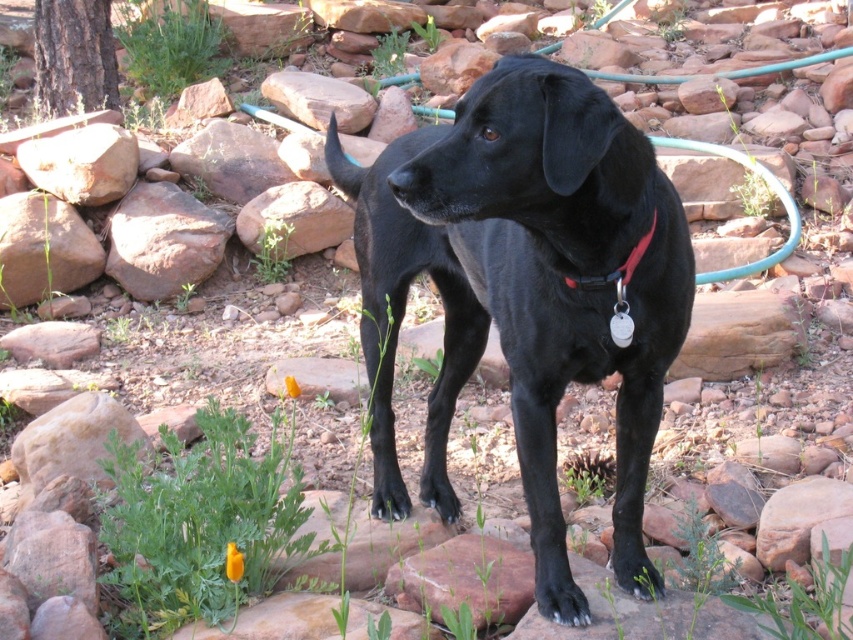
Question: Which point appears closest to the camera in this image?

Choices:
 (A) (651, 237)
 (B) (138, 227)

Answer: (A)

Question: Does green rubber hose at upper center have a larger size compared to red nylon collar at center?

Choices:
 (A) no
 (B) yes

Answer: (B)

Question: Among these objects, which one is nearest to the camera?

Choices:
 (A) smooth brown rock at upper left
 (B) black matte dog at center
 (C) green rubber hose at upper center
 (D) red nylon collar at center

Answer: (B)

Question: Considering the relative positions of black matte dog at center and green rubber hose at upper center in the image provided, where is black matte dog at center located with respect to green rubber hose at upper center?

Choices:
 (A) above
 (B) below

Answer: (B)

Question: In this image, where is reddish-brown rock at lower left located relative to green rubber hose at upper center?

Choices:
 (A) left
 (B) right

Answer: (A)

Question: Which point appears closest to the camera in this image?

Choices:
 (A) (485, 278)
 (B) (619, 276)
 (C) (791, 252)

Answer: (B)